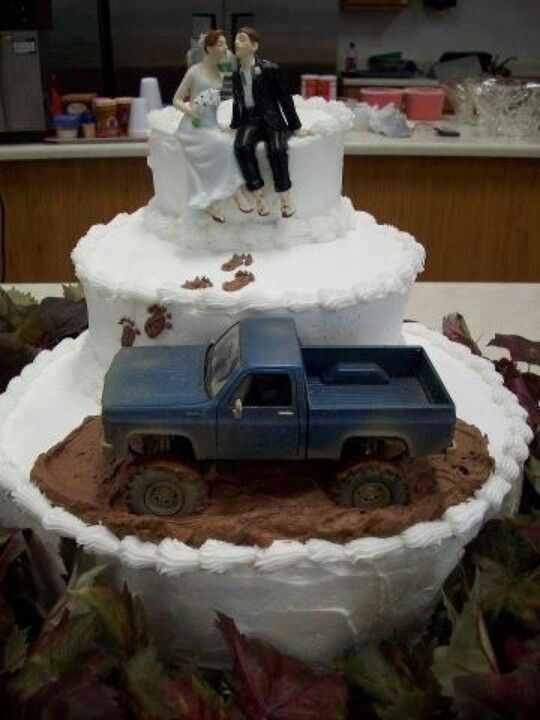
Image resolution: width=540 pixels, height=720 pixels. Identify the location of cups. (140, 111), (150, 91).